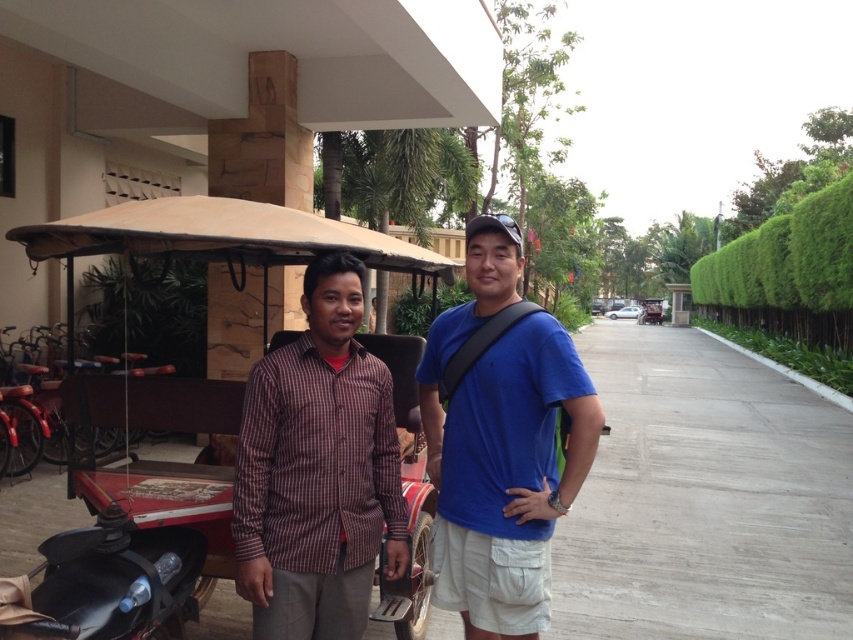
You are planning to transport a large piece of furniture using the wooden cart at left and the brown checkered shirt at center. Which object would be more suitable for carrying heavy items?

The wooden cart at left is more suitable for carrying heavy items because it has a larger size compared to the brown checkered shirt at center.

You are a tourist in a tropical area and want to take a photo with the wooden cart at left and the blue matte shirt at center. Can you stand in a position where both objects are visible in the frame?

The wooden cart at left is positioned over the blue matte shirt at center, so you can stand in a position where both objects are visible in the frame.